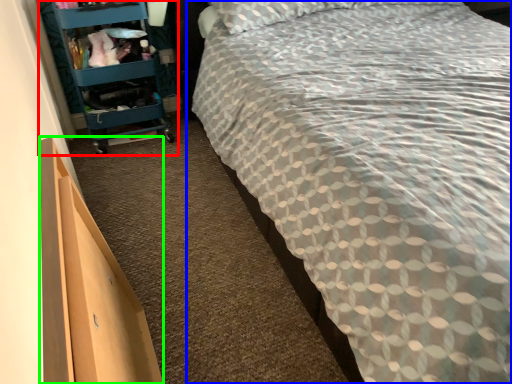
Question: Which object is the farthest from furniture (highlighted by a red box)? Choose among these: bed (highlighted by a blue box) or drawer (highlighted by a green box).

Choices:
 (A) bed
 (B) drawer

Answer: (B)